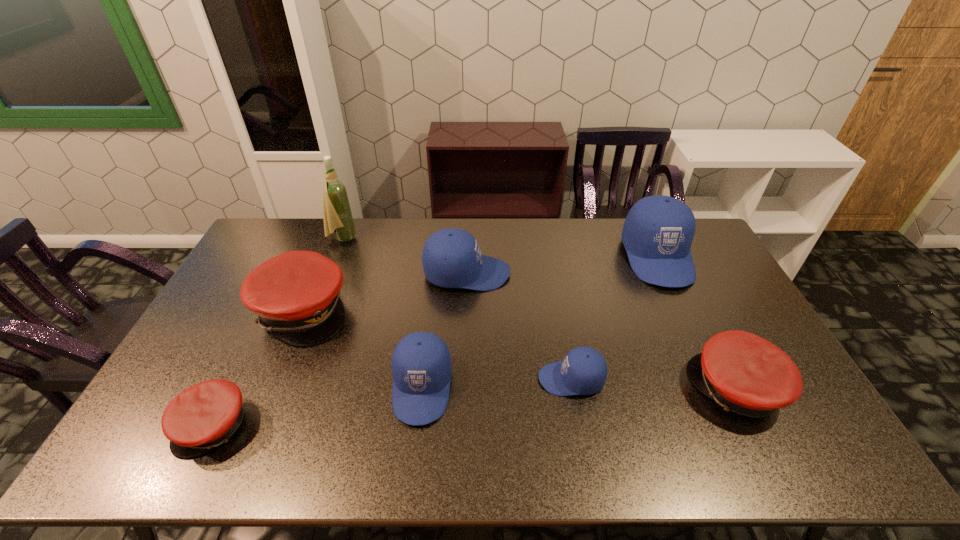
This screenshot has height=540, width=960. Identify the location of vacant space situated on the front-facing side of the second blue cap from right to left. (516, 379).

What are the coordinates of `vacant region located 0.370m on the front-facing side of the second blue cap from right to left` in the screenshot? It's located at (404, 379).

I want to click on vacant area situated on the front-facing side of the second blue cap from right to left, so click(x=462, y=379).

Locate an element on the screen. Image resolution: width=960 pixels, height=540 pixels. wine bottle that is at the far edge is located at coordinates (337, 214).

What are the coordinates of `object located in the near edge section of the desktop` in the screenshot? It's located at (205, 415).

What are the coordinates of `object located at the near left corner` in the screenshot? It's located at (205, 415).

At what (x,y) coordinates should I click in order to perform the action: click on object positioned at the far right corner. Please return your answer as a coordinate pair (x, y). This screenshot has height=540, width=960. Looking at the image, I should click on (658, 231).

Image resolution: width=960 pixels, height=540 pixels. I want to click on vacant space at the far edge, so click(575, 255).

This screenshot has width=960, height=540. In the image, there is a desktop. Find the location of `vacant region at the near edge`. vacant region at the near edge is located at coordinates (287, 468).

Find the location of `vacant space at the left edge`. vacant space at the left edge is located at coordinates (231, 301).